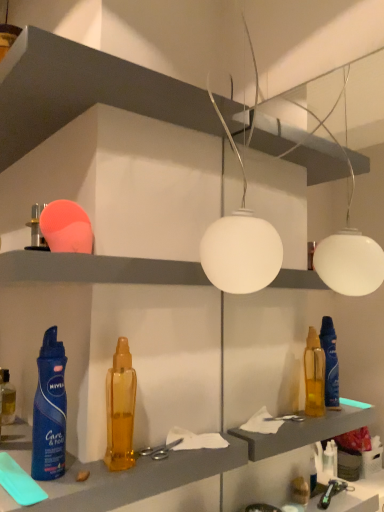
Identify the location of spots to the right of silver metallic scissors at center. The width and height of the screenshot is (384, 512). (225, 442).